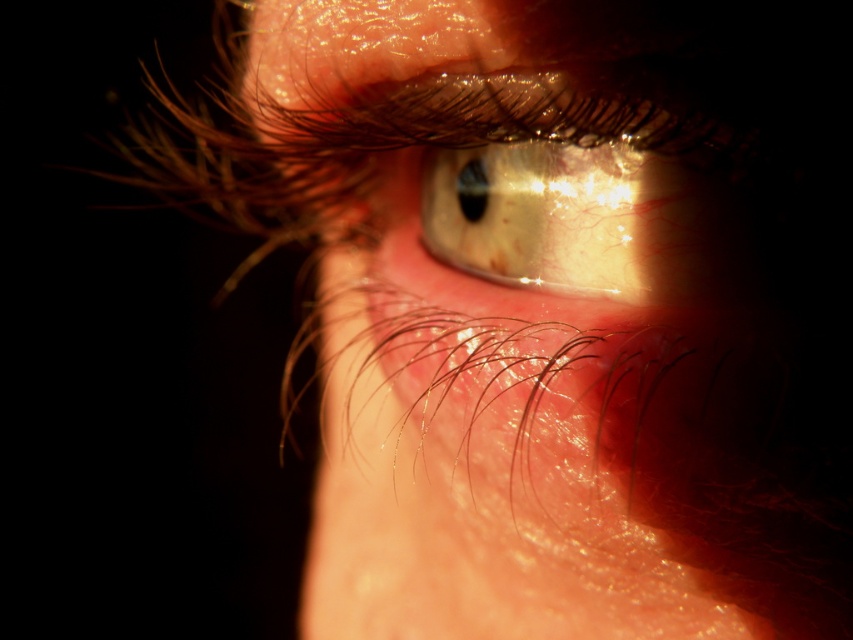
Question: Is smooth skin eye at center behind shiny gold eye at center?

Choices:
 (A) no
 (B) yes

Answer: (A)

Question: Which point appears closest to the camera in this image?

Choices:
 (A) (430, 186)
 (B) (527, 268)

Answer: (B)

Question: Does smooth skin eye at center have a greater width compared to shiny gold eye at center?

Choices:
 (A) yes
 (B) no

Answer: (A)

Question: Which point is closer to the camera?

Choices:
 (A) (735, 582)
 (B) (457, 260)

Answer: (A)

Question: Is smooth skin eye at center to the right of shiny gold eye at center from the viewer's perspective?

Choices:
 (A) yes
 (B) no

Answer: (B)